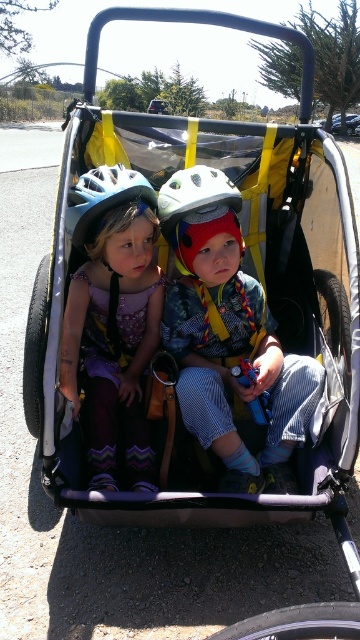
The width and height of the screenshot is (360, 640). What do you see at coordinates (228, 337) in the screenshot?
I see `matte blue helmet at center` at bounding box center [228, 337].

Between matte blue helmet at center and white matte helmet at center, which one has less height?

With less height is white matte helmet at center.

Where is `matte blue helmet at center`? The height and width of the screenshot is (640, 360). matte blue helmet at center is located at coordinates (228, 337).

Identify the location of matte blue helmet at center. This screenshot has width=360, height=640. (228, 337).

Looking at this image, who is higher up, white matte helmet at center or matte white helmet at center?

matte white helmet at center is higher up.

Can you confirm if white matte helmet at center is positioned to the right of matte white helmet at center?

Yes, white matte helmet at center is to the right of matte white helmet at center.

Identify the location of white matte helmet at center. This screenshot has height=640, width=360. (196, 211).

Between point (195, 224) and point (243, 381), which one is positioned behind?

Point (243, 381)

Between point (212, 189) and point (231, 372), which one is positioned in front?

Positioned in front is point (212, 189).

The height and width of the screenshot is (640, 360). Describe the element at coordinates (196, 211) in the screenshot. I see `white matte helmet at center` at that location.

Identify the location of white matte helmet at center. (196, 211).